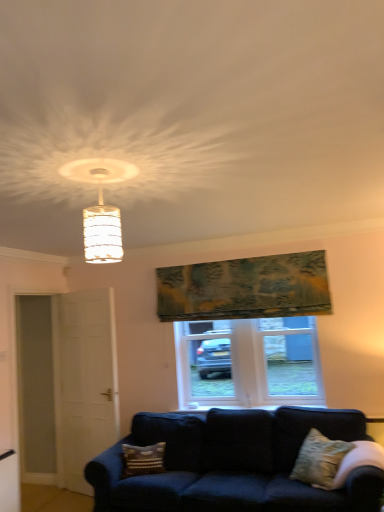
Question: From a real-world perspective, is textured beige pillow at lower right, which is counted as the first pillow, starting from the front, physically below patterned fabric pillow at lower center, acting as the 2th pillow starting from the right?

Choices:
 (A) no
 (B) yes

Answer: (A)

Question: Is textured beige pillow at lower right, which is counted as the first pillow, starting from the front, positioned with its back to patterned fabric pillow at lower center, acting as the 2th pillow starting from the right?

Choices:
 (A) no
 (B) yes

Answer: (A)

Question: Is textured beige pillow at lower right, which is counted as the first pillow, starting from the front, behind patterned fabric pillow at lower center, acting as the 2th pillow starting from the right?

Choices:
 (A) no
 (B) yes

Answer: (A)

Question: Is textured beige pillow at lower right, placed as the second pillow when sorted from back to front, facing towards patterned fabric pillow at lower center, positioned as the second pillow in front-to-back order?

Choices:
 (A) no
 (B) yes

Answer: (A)

Question: Is textured beige pillow at lower right, which is counted as the first pillow, starting from the front, thinner than patterned fabric pillow at lower center, which is the first pillow in left-to-right order?

Choices:
 (A) no
 (B) yes

Answer: (A)

Question: From a real-world perspective, is textured beige pillow at lower right, which ranks as the second pillow in left-to-right order, over patterned fabric pillow at lower center, positioned as the second pillow in front-to-back order?

Choices:
 (A) yes
 (B) no

Answer: (A)

Question: Does white matte door at left have a greater width compared to textured beige pillow at lower right, which is counted as the first pillow, starting from the front?

Choices:
 (A) yes
 (B) no

Answer: (B)

Question: Is white matte door at left not within textured beige pillow at lower right, the 1th pillow viewed from the right?

Choices:
 (A) no
 (B) yes

Answer: (B)

Question: From the image's perspective, is white matte door at left under textured beige pillow at lower right, which is counted as the first pillow, starting from the front?

Choices:
 (A) yes
 (B) no

Answer: (B)

Question: Would you say white matte door at left contains textured beige pillow at lower right, the 1th pillow viewed from the right?

Choices:
 (A) no
 (B) yes

Answer: (A)

Question: Can you confirm if white matte door at left is shorter than textured beige pillow at lower right, the 1th pillow viewed from the right?

Choices:
 (A) yes
 (B) no

Answer: (B)

Question: Can you confirm if white matte door at left is taller than textured beige pillow at lower right, which ranks as the second pillow in left-to-right order?

Choices:
 (A) yes
 (B) no

Answer: (A)

Question: Is patterned fabric pillow at lower center, positioned as the second pillow in front-to-back order, facing away from textured green tapestry at upper center?

Choices:
 (A) no
 (B) yes

Answer: (A)